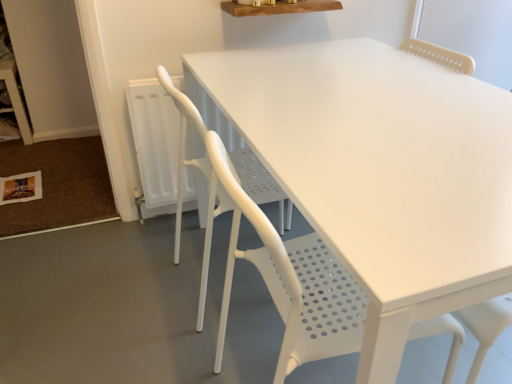
Find the location of a particular element. Image resolution: width=512 pixels, height=384 pixels. white perforated chair at center, which is counted as the first chair, starting from the back is located at coordinates [x=205, y=176].

Image resolution: width=512 pixels, height=384 pixels. What do you see at coordinates (205, 176) in the screenshot? I see `white perforated chair at center, which is counted as the first chair, starting from the back` at bounding box center [205, 176].

How much space does white perforated chair at center, which is counted as the first chair, starting from the back, occupy horizontally?

It is 51.89 centimeters.

At what (x,y) coordinates should I click in order to perform the action: click on white matte chair at center, the first chair positioned from the front. Please return your answer as a coordinate pair (x, y). Looking at the image, I should click on (284, 272).

This screenshot has width=512, height=384. Describe the element at coordinates (284, 272) in the screenshot. I see `white matte chair at center, the first chair positioned from the front` at that location.

Measure the distance between white matte chair at center, the 2th chair from the back, and camera.

white matte chair at center, the 2th chair from the back, and camera are 24.02 inches apart from each other.

Locate an element on the screen. The image size is (512, 384). white perforated chair at center, positioned as the second chair in front-to-back order is located at coordinates (205, 176).

Can you confirm if white perforated chair at center, which is counted as the first chair, starting from the back, is positioned to the right of white matte chair at center, the first chair positioned from the front?

No.

From the picture: Who is more distant, white perforated chair at center, positioned as the second chair in front-to-back order, or white matte chair at center, the first chair positioned from the front?

white perforated chair at center, positioned as the second chair in front-to-back order, is more distant.

Which point is more forward, (159,78) or (450,378)?

The point (450,378) is more forward.

From the image's perspective, is white perforated chair at center, which is counted as the first chair, starting from the back, located beneath white matte chair at center, the first chair positioned from the front?

Incorrect, from the image's perspective, white perforated chair at center, which is counted as the first chair, starting from the back, is higher than white matte chair at center, the first chair positioned from the front.

From a real-world perspective, between white perforated chair at center, positioned as the second chair in front-to-back order, and white matte chair at center, the first chair positioned from the front, who is vertically higher?

white perforated chair at center, positioned as the second chair in front-to-back order, is physically above.

Considering the sizes of objects white perforated chair at center, which is counted as the first chair, starting from the back, and white matte chair at center, the 2th chair from the back, in the image provided, who is wider, white perforated chair at center, which is counted as the first chair, starting from the back, or white matte chair at center, the 2th chair from the back,?

With larger width is white perforated chair at center, which is counted as the first chair, starting from the back.

Does white perforated chair at center, positioned as the second chair in front-to-back order, have a lesser height compared to white matte chair at center, the 2th chair from the back?

Indeed, white perforated chair at center, positioned as the second chair in front-to-back order, has a lesser height compared to white matte chair at center, the 2th chair from the back.

Does white perforated chair at center, which is counted as the first chair, starting from the back, have a larger size compared to white matte chair at center, the 2th chair from the back?

Indeed, white perforated chair at center, which is counted as the first chair, starting from the back, has a larger size compared to white matte chair at center, the 2th chair from the back.

Is white perforated chair at center, which is counted as the first chair, starting from the back, not inside white matte chair at center, the first chair positioned from the front?

Yes.

Is white perforated chair at center, which is counted as the first chair, starting from the back, not near white matte chair at center, the first chair positioned from the front?

white perforated chair at center, which is counted as the first chair, starting from the back, is near white matte chair at center, the first chair positioned from the front, not far away.

Does white perforated chair at center, positioned as the second chair in front-to-back order, turn towards white matte chair at center, the 2th chair from the back?

No, white perforated chair at center, positioned as the second chair in front-to-back order, is not facing towards white matte chair at center, the 2th chair from the back.

How many degrees apart are the facing directions of white perforated chair at center, positioned as the second chair in front-to-back order, and white matte chair at center, the first chair positioned from the front?

0.00191 degrees.

At what (x,y) coordinates should I click in order to perform the action: click on chair in front of the white perforated chair at center, which is counted as the first chair, starting from the back. Please return your answer as a coordinate pair (x, y). Image resolution: width=512 pixels, height=384 pixels. Looking at the image, I should click on (284, 272).

Between white matte chair at center, the 2th chair from the back, and white perforated chair at center, positioned as the second chair in front-to-back order, which one appears on the right side from the viewer's perspective?

From the viewer's perspective, white matte chair at center, the 2th chair from the back, appears more on the right side.

In the image, is white matte chair at center, the first chair positioned from the front, positioned in front of or behind white perforated chair at center, positioned as the second chair in front-to-back order?

In the image, white matte chair at center, the first chair positioned from the front, appears in front of white perforated chair at center, positioned as the second chair in front-to-back order.

Is point (219, 343) more distant than point (202, 137)?

Yes, it is.

From the image's perspective, who appears lower, white matte chair at center, the 2th chair from the back, or white perforated chair at center, which is counted as the first chair, starting from the back?

white matte chair at center, the 2th chair from the back, from the image's perspective.

From a real-world perspective, who is located higher, white matte chair at center, the 2th chair from the back, or white perforated chair at center, which is counted as the first chair, starting from the back?

Answer: white perforated chair at center, which is counted as the first chair, starting from the back, is physically above.

Considering the sizes of objects white matte chair at center, the 2th chair from the back, and white perforated chair at center, positioned as the second chair in front-to-back order, in the image provided, who is wider, white matte chair at center, the 2th chair from the back, or white perforated chair at center, positioned as the second chair in front-to-back order,?

white perforated chair at center, positioned as the second chair in front-to-back order.

Based on the photo, is white matte chair at center, the first chair positioned from the front, shorter than white perforated chair at center, positioned as the second chair in front-to-back order?

No, white matte chair at center, the first chair positioned from the front, is not shorter than white perforated chair at center, positioned as the second chair in front-to-back order.

Can you confirm if white matte chair at center, the 2th chair from the back, is bigger than white perforated chair at center, positioned as the second chair in front-to-back order?

Incorrect, white matte chair at center, the 2th chair from the back, is not larger than white perforated chair at center, positioned as the second chair in front-to-back order.

Is white perforated chair at center, which is counted as the first chair, starting from the back, inside white matte chair at center, the first chair positioned from the front?

Actually, white perforated chair at center, which is counted as the first chair, starting from the back, is outside white matte chair at center, the first chair positioned from the front.

Is white matte chair at center, the first chair positioned from the front, beside white perforated chair at center, which is counted as the first chair, starting from the back?

white matte chair at center, the first chair positioned from the front, and white perforated chair at center, which is counted as the first chair, starting from the back, are clearly separated.

Is white matte chair at center, the first chair positioned from the front, facing away from white perforated chair at center, positioned as the second chair in front-to-back order?

That's not correct — white matte chair at center, the first chair positioned from the front, is not looking away from white perforated chair at center, positioned as the second chair in front-to-back order.

Can you tell me how much white matte chair at center, the 2th chair from the back, and white perforated chair at center, which is counted as the first chair, starting from the back, differ in facing direction?

0.00191 degrees separate the facing orientations of white matte chair at center, the 2th chair from the back, and white perforated chair at center, which is counted as the first chair, starting from the back.

At what (x,y) coordinates should I click in order to perform the action: click on chair that appears above the white matte chair at center, the first chair positioned from the front (from a real-world perspective). Please return your answer as a coordinate pair (x, y). Looking at the image, I should click on (205, 176).

Locate an element on the screen. The height and width of the screenshot is (384, 512). chair below the white perforated chair at center, which is counted as the first chair, starting from the back (from a real-world perspective) is located at coordinates (284, 272).

Find the location of a particular element. This screenshot has width=512, height=384. chair lying behind the white matte chair at center, the first chair positioned from the front is located at coordinates (205, 176).